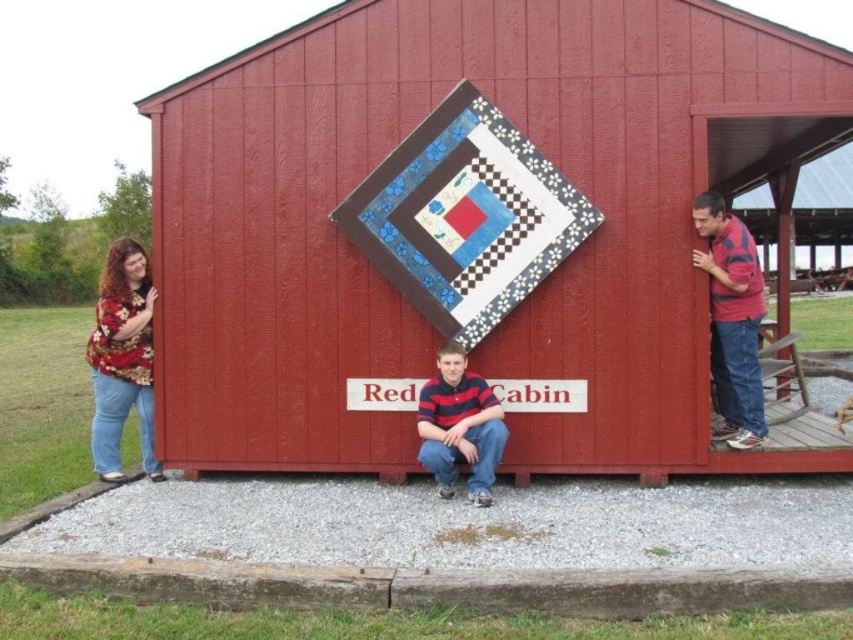
Question: Which point is farther to the camera?

Choices:
 (A) smooth wooden barn at center
 (B) striped polo shirt at center

Answer: (A)

Question: Does quilted fabric quilt at center appear under striped cotton shirt at right?

Choices:
 (A) no
 (B) yes

Answer: (A)

Question: Among these points, which one is farthest from the camera?

Choices:
 (A) (424, 316)
 (B) (732, 259)
 (C) (86, 340)

Answer: (C)

Question: Is floral-patterned blouse at left bigger than striped polo shirt at center?

Choices:
 (A) yes
 (B) no

Answer: (A)

Question: Which object appears closest to the camera in this image?

Choices:
 (A) striped cotton shirt at right
 (B) quilted fabric quilt at center
 (C) striped polo shirt at center

Answer: (C)

Question: Is floral-patterned blouse at left positioned in front of striped cotton shirt at right?

Choices:
 (A) no
 (B) yes

Answer: (A)